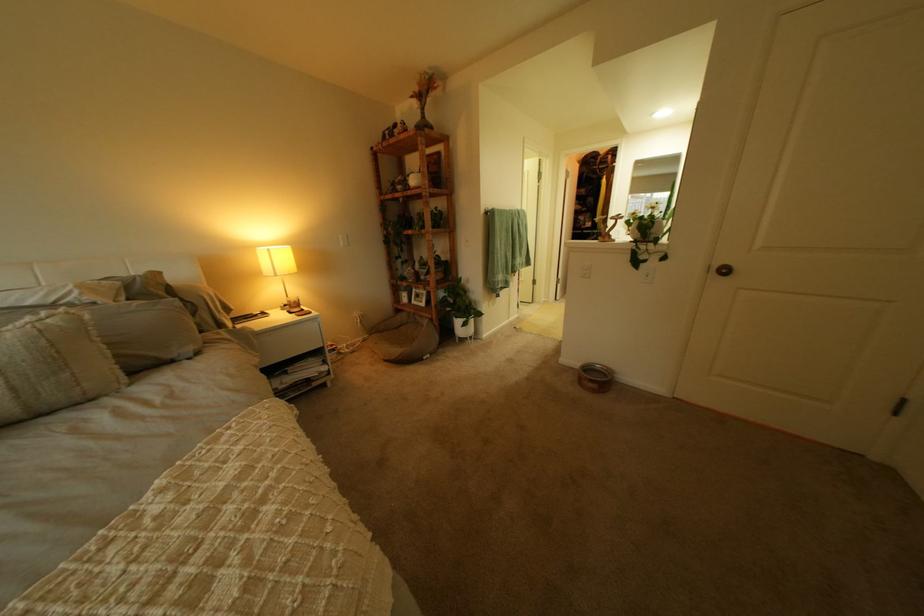
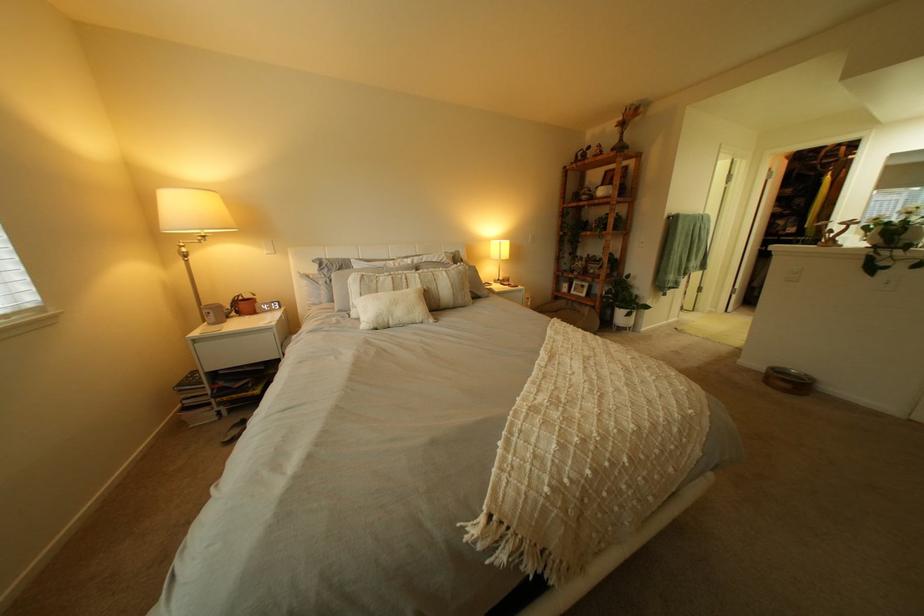
The point at (593, 367) is marked in the first image. Where is the corresponding point in the second image?

(779, 369)